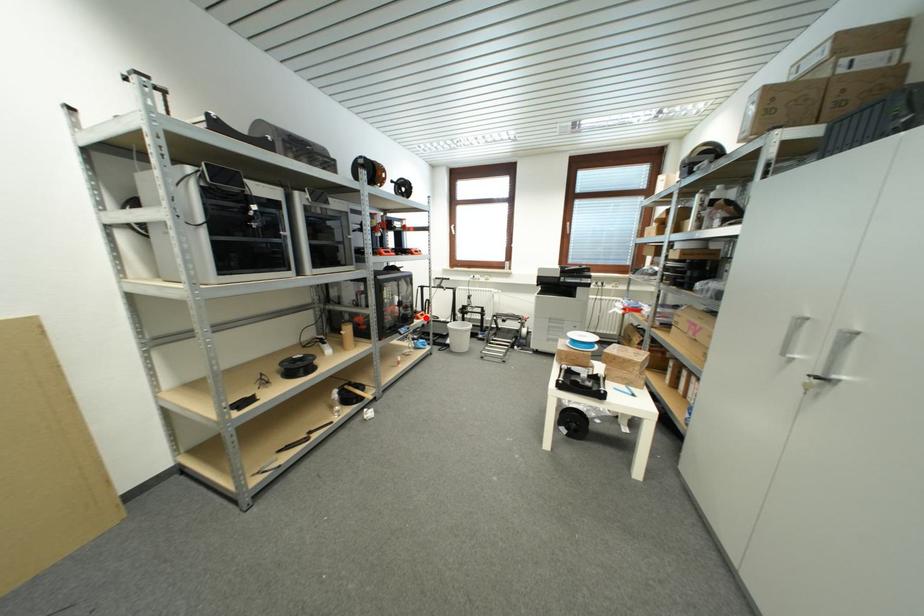
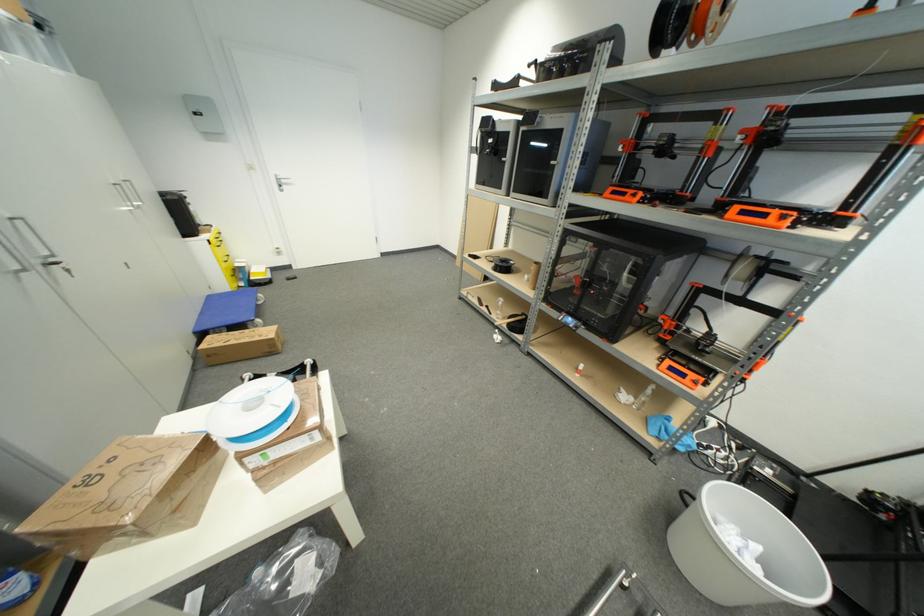
Where in the second image is the point corresponding to the highlighted location from the first image?

(675, 371)